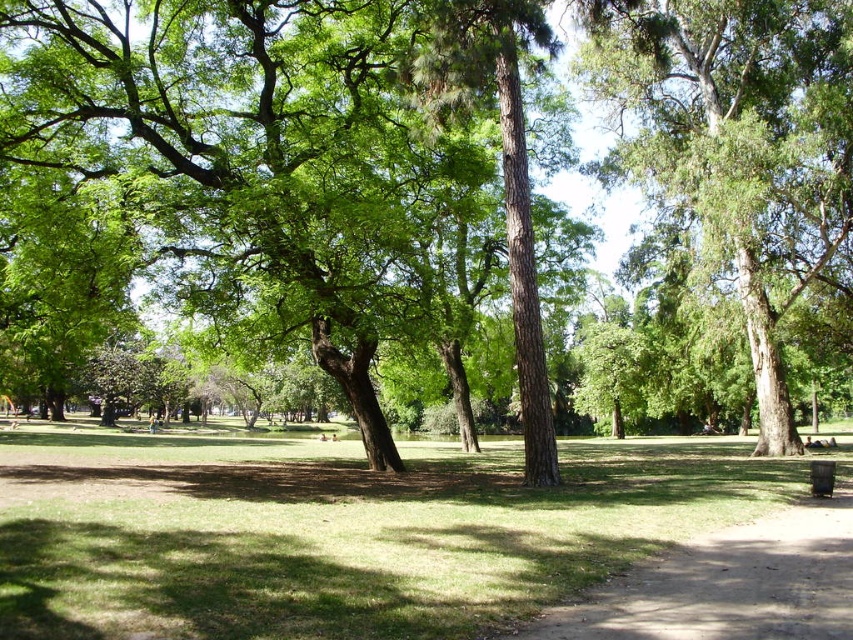
You are standing in the park and want to take a photo of the green leafy tree at center. If your camera has a maximum focus range of 60 feet, will you be able to focus on the tree?

The green leafy tree at center is 66.54 feet away from the viewer. Since the camera can only focus up to 60 feet, it will not be able to focus on the tree.